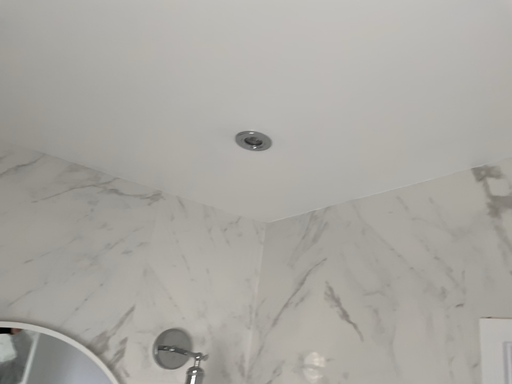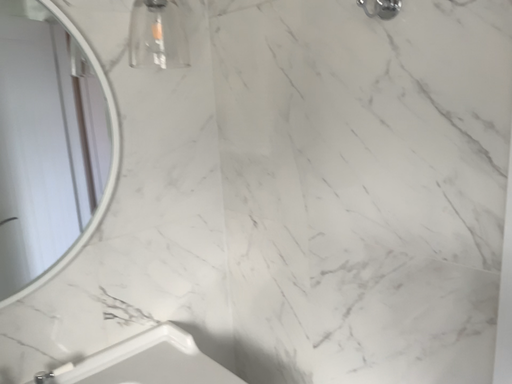
Question: Which way did the camera rotate in the video?

Choices:
 (A) rotated left
 (B) rotated right

Answer: (B)